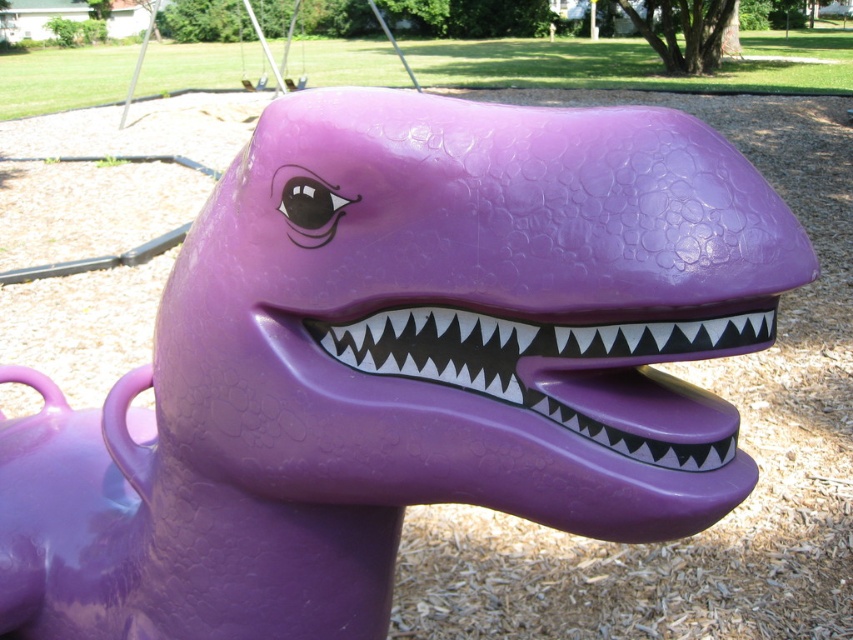
Question: Is glossy purple mouth at center below metallic silver swing at upper center?

Choices:
 (A) no
 (B) yes

Answer: (B)

Question: Can you confirm if glossy purple mouth at center is positioned above metallic silver swing at upper center?

Choices:
 (A) yes
 (B) no

Answer: (B)

Question: Which object is closer to the camera taking this photo?

Choices:
 (A) glossy purple mouth at center
 (B) metallic silver swing at upper center

Answer: (A)

Question: Which object appears closest to the camera in this image?

Choices:
 (A) metallic silver swing at upper center
 (B) glossy purple mouth at center

Answer: (B)

Question: Can you confirm if glossy purple mouth at center is smaller than metallic silver swing at upper center?

Choices:
 (A) yes
 (B) no

Answer: (A)

Question: Which of the following is the farthest from the observer?

Choices:
 (A) (271, 65)
 (B) (666, 422)

Answer: (A)